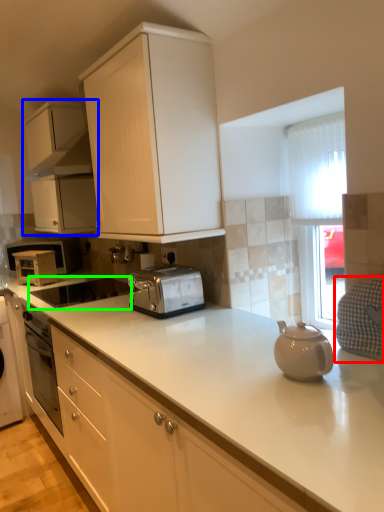
Question: Considering the real-world distances, which object is closest to gray (highlighted by a red box)? cabinetry (highlighted by a blue box) or appliance (highlighted by a green box).

Choices:
 (A) cabinetry
 (B) appliance

Answer: (B)